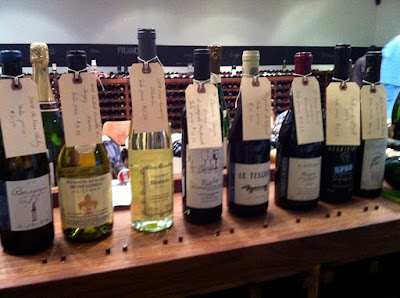
In order to click on light grey wall in this screenshot , I will do `click(83, 7)`, `click(393, 19)`, `click(350, 13)`, `click(281, 16)`, `click(183, 11)`, `click(23, 7)`.